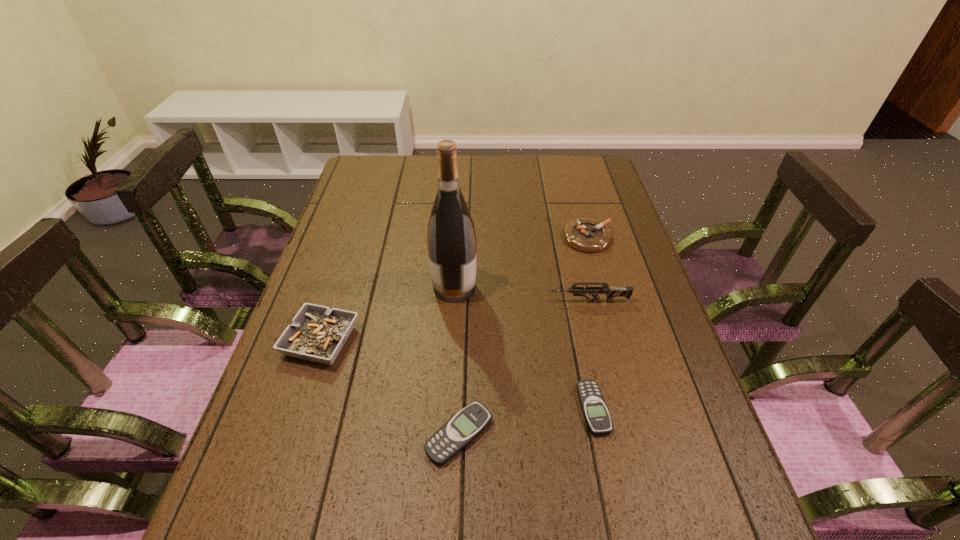
This screenshot has height=540, width=960. In order to click on vacant space that satisfies the following two spatial constraints: 1. on the label of the tallest object; 2. on the back side of the second shortest object in this screenshot , I will do click(x=445, y=435).

In order to click on vacant point that satisfies the following two spatial constraints: 1. on the label of the left beeper; 2. on the left side of the wine bottle in this screenshot , I will do `click(445, 435)`.

Identify the location of vacant position in the image that satisfies the following two spatial constraints: 1. on the label of the tallest object; 2. on the right side of the taller beeper. (445, 435).

The image size is (960, 540). Identify the location of vacant space that satisfies the following two spatial constraints: 1. on the back side of the taller beeper; 2. on the left side of the right ashtray. 467,238.

This screenshot has height=540, width=960. I want to click on vacant space that satisfies the following two spatial constraints: 1. on the back side of the leftmost object; 2. on the left side of the right ashtray, so click(354, 238).

Locate an element on the screen. blank area in the image that satisfies the following two spatial constraints: 1. on the label of the wine bottle; 2. on the back side of the left beeper is located at coordinates (445, 435).

This screenshot has width=960, height=540. Identify the location of free space that satisfies the following two spatial constraints: 1. on the label of the taller beeper; 2. on the right side of the wine bottle. (445, 435).